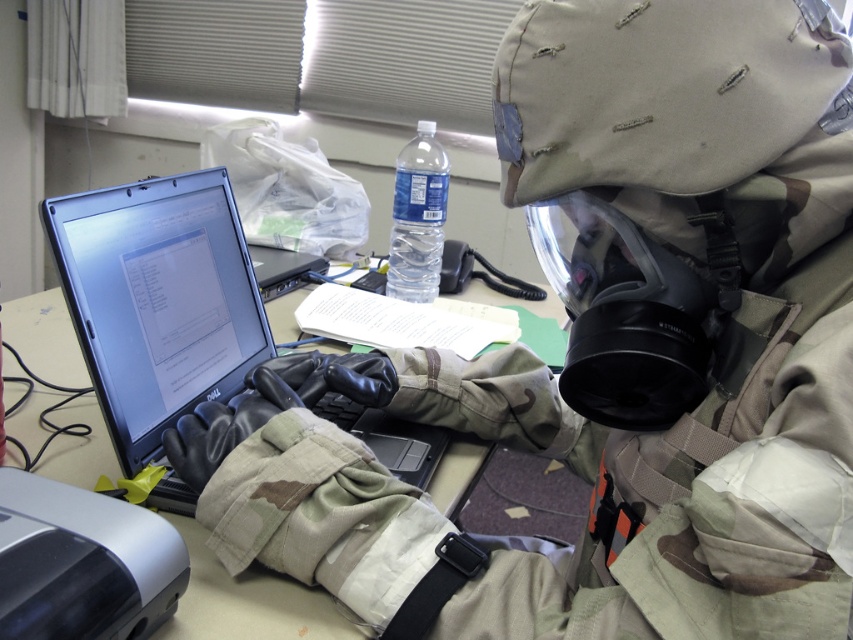
Is matte black laptop at center left bigger than matte black laptop at center?

No.

Who is positioned more to the left, matte black laptop at center left or matte black laptop at center?

A: From the viewer's perspective, matte black laptop at center appears more on the left side.

Is point (144, 182) farther from viewer compared to point (282, 584)?

Yes, it is.

In order to click on matte black laptop at center left in this screenshot , I will do `click(158, 300)`.

Is matte black laptop at center to the left of clear plastic bottle at center from the viewer's perspective?

Yes, matte black laptop at center is to the left of clear plastic bottle at center.

Between point (12, 316) and point (436, 196), which one is positioned behind?

Positioned behind is point (436, 196).

I want to click on matte black laptop at center, so click(248, 602).

Is matte black laptop at center left to the right of clear plastic bottle at center from the viewer's perspective?

No, matte black laptop at center left is not to the right of clear plastic bottle at center.

The width and height of the screenshot is (853, 640). What do you see at coordinates (158, 300) in the screenshot?
I see `matte black laptop at center left` at bounding box center [158, 300].

Between point (141, 280) and point (427, 131), which one is positioned in front?

Positioned in front is point (141, 280).

The height and width of the screenshot is (640, 853). What are the coordinates of `matte black laptop at center left` in the screenshot? It's located at (158, 300).